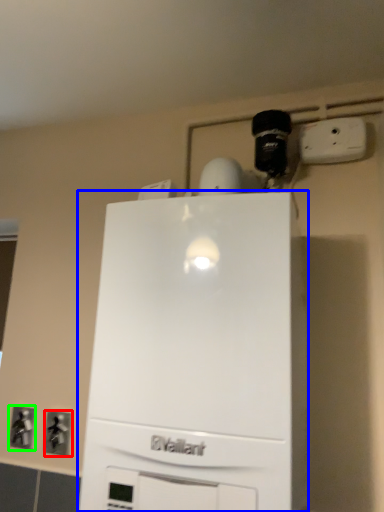
Question: Which object is the closest to the electric outlet (highlighted by a red box)? Choose among these: home appliance (highlighted by a blue box) or electric outlet (highlighted by a green box).

Choices:
 (A) home appliance
 (B) electric outlet

Answer: (B)